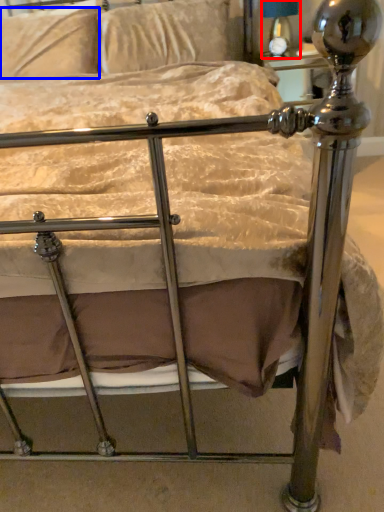
Question: Among these objects, which one is nearest to the camera, table lamp (highlighted by a red box) or pillow (highlighted by a blue box)?

Choices:
 (A) table lamp
 (B) pillow

Answer: (B)